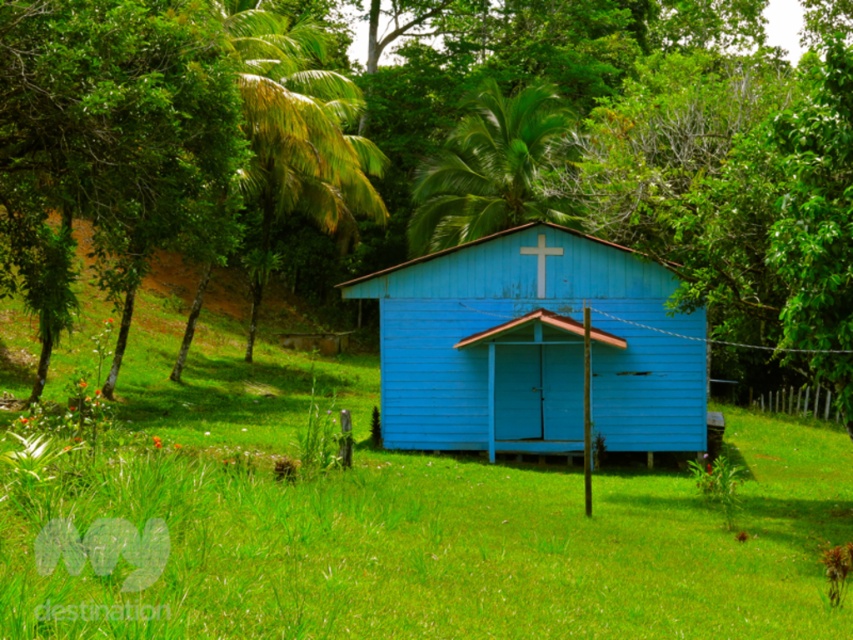
Question: Can you confirm if green leafy tree at left is positioned below green leafy palm tree at upper center?

Choices:
 (A) no
 (B) yes

Answer: (B)

Question: Is blue wooden hut at center wider than green leafy palm tree at upper center?

Choices:
 (A) no
 (B) yes

Answer: (B)

Question: Which object appears farthest from the camera in this image?

Choices:
 (A) green leafy tree at left
 (B) blue wooden hut at center
 (C) green leafy palm tree at upper center

Answer: (C)

Question: Among these points, which one is farthest from the camera?

Choices:
 (A) (178, 214)
 (B) (529, 266)

Answer: (B)

Question: Which point is farther to the camera?

Choices:
 (A) green leafy palm tree at upper center
 (B) green leafy tree at left

Answer: (A)

Question: Can you confirm if blue wooden hut at center is positioned below green leafy tree at left?

Choices:
 (A) no
 (B) yes

Answer: (B)